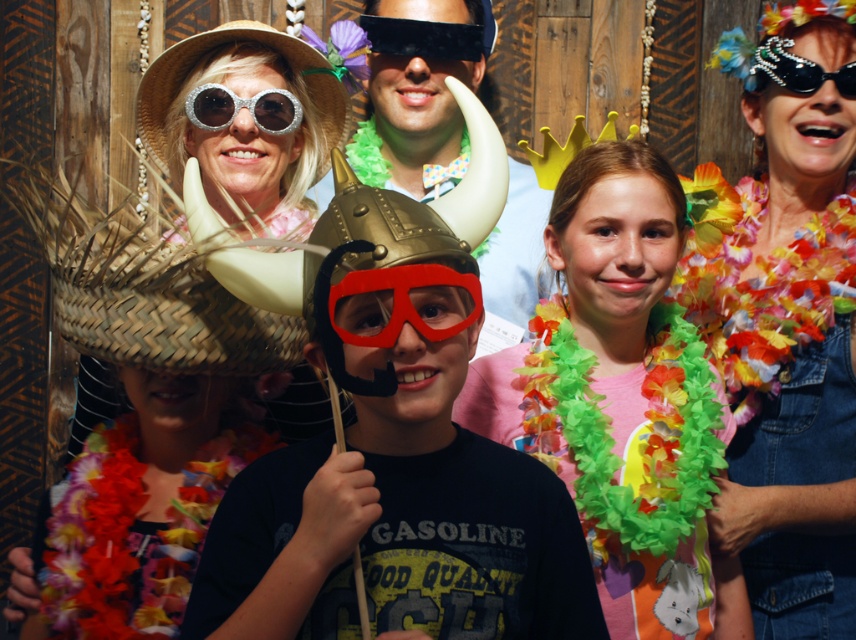
Question: Among these objects, which one is nearest to the camera?

Choices:
 (A) denim dress at upper right
 (B) brown woven straw hat at left

Answer: (B)

Question: Can you confirm if matte pink shirt at center is positioned above black matte goggles at upper center?

Choices:
 (A) no
 (B) yes

Answer: (A)

Question: Can you confirm if metallic gold helmet at center is positioned below pearl encrusted sunglasses at upper right?

Choices:
 (A) yes
 (B) no

Answer: (A)

Question: Which of the following is the closest to the observer?

Choices:
 (A) glittery silver goggles at upper left
 (B) straw hat at upper left

Answer: (B)

Question: Considering the real-world distances, which object is closest to the pearl encrusted sunglasses at upper right?

Choices:
 (A) glittery silver goggles at upper left
 (B) metallic gold helmet at center
 (C) straw hat at upper left
 (D) red matte goggles at center

Answer: (C)

Question: Does brown woven straw hat at left appear on the right side of glittery silver goggles at upper left?

Choices:
 (A) no
 (B) yes

Answer: (A)